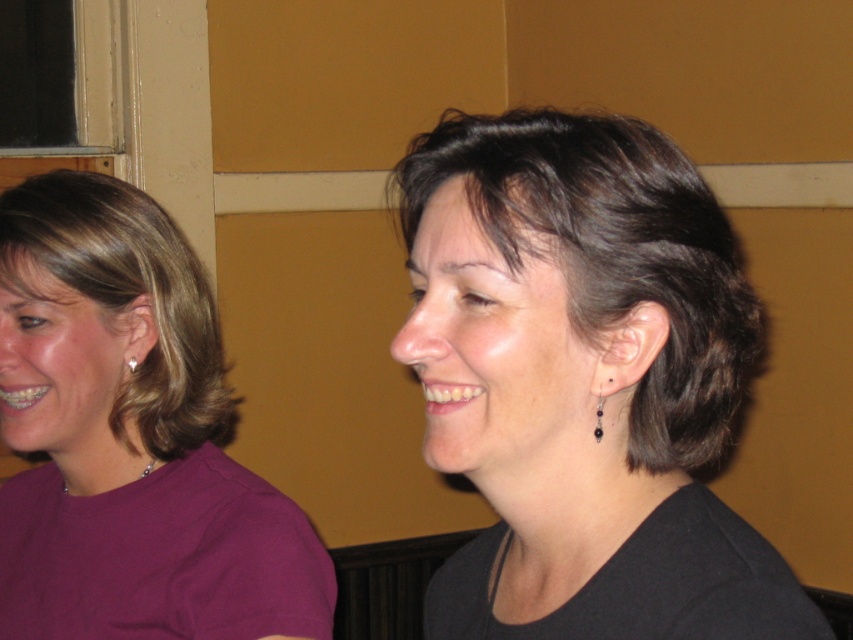
From the picture: Can you confirm if black matte hair at center is positioned to the left of purple matte shirt at left?

Incorrect, black matte hair at center is not on the left side of purple matte shirt at left.

Which is more to the right, black matte hair at center or purple matte shirt at left?

black matte hair at center is more to the right.

Between point (670, 442) and point (74, 493), which one is positioned behind?

The point (74, 493) is more distant.

You are a GUI agent. You are given a task and a screenshot of the screen. Output one action in this format:
    pyautogui.click(x=<x>, y=<y>)
    Task: Click on the black matte hair at center
    
    Given the screenshot: What is the action you would take?
    pyautogui.click(x=584, y=381)

Does black matte hair at center appear under silver/glass drop earrings at ear?

No.

Does point (477, 234) lie in front of point (595, 440)?

Yes.

Measure the distance between black matte hair at center and camera.

black matte hair at center is 26.69 inches from camera.

The height and width of the screenshot is (640, 853). Find the location of `black matte hair at center`. black matte hair at center is located at coordinates (584, 381).

Does blonde hair at left have a greater height compared to silver metallic earring at left?

Indeed, blonde hair at left has a greater height compared to silver metallic earring at left.

Is point (155, 237) positioned in front of point (135, 369)?

No, it is behind (135, 369).

You are a GUI agent. You are given a task and a screenshot of the screen. Output one action in this format:
    pyautogui.click(x=<x>, y=<y>)
    Task: Click on the blonde hair at left
    
    Given the screenshot: What is the action you would take?
    pyautogui.click(x=131, y=298)

At what (x,y) coordinates should I click in order to perform the action: click on blonde hair at left. Please return your answer as a coordinate pair (x, y). The image size is (853, 640). Looking at the image, I should click on (131, 298).